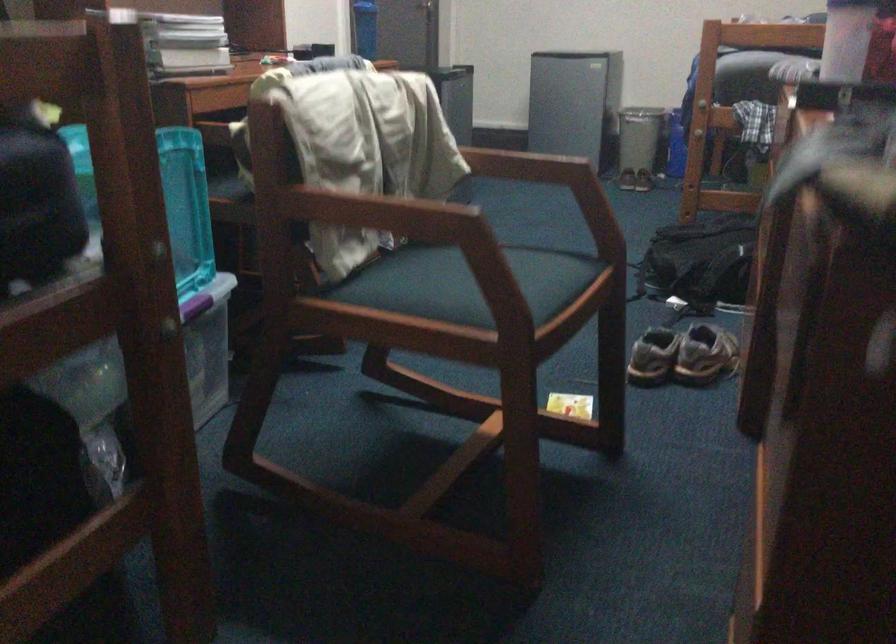
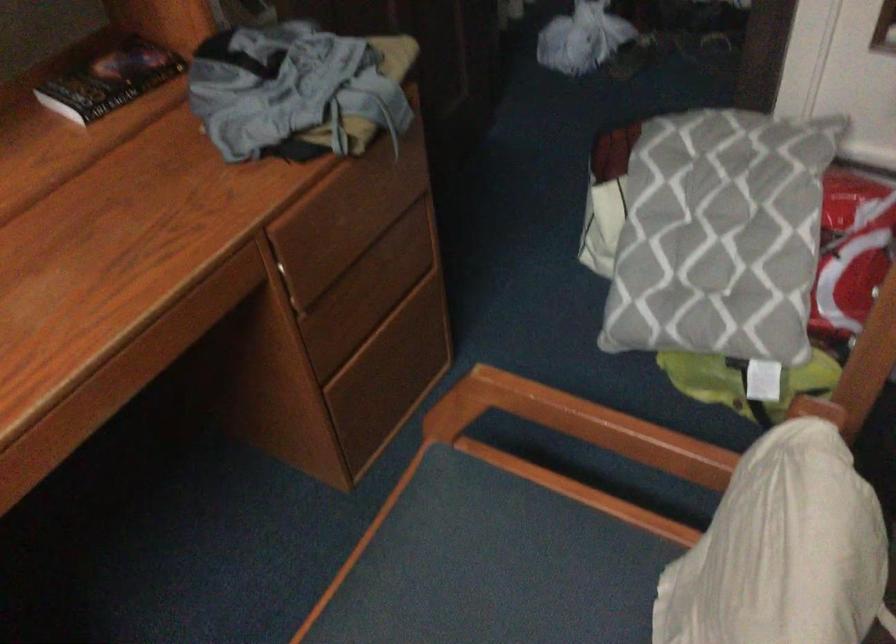
Question: I am providing you with two images of the same scene from different viewpoints. Please identify which objects are invisible in image2.

Choices:
 (A) drawer pull
 (B) chair sitting surface
 (C) wooden chair armrest
 (D) red rectangular magnet

Answer: (C)